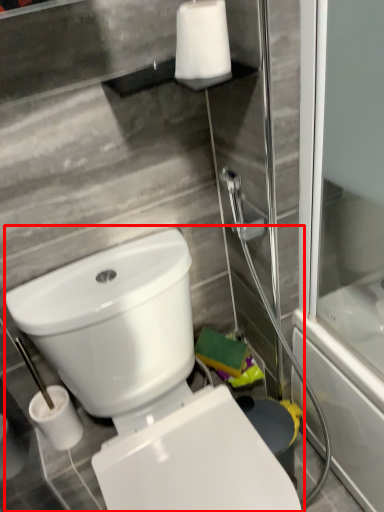
Question: Considering the relative positions of toilet (annotated by the red box) and toilet paper in the image provided, where is toilet (annotated by the red box) located with respect to the staircase?

Choices:
 (A) right
 (B) left

Answer: (B)